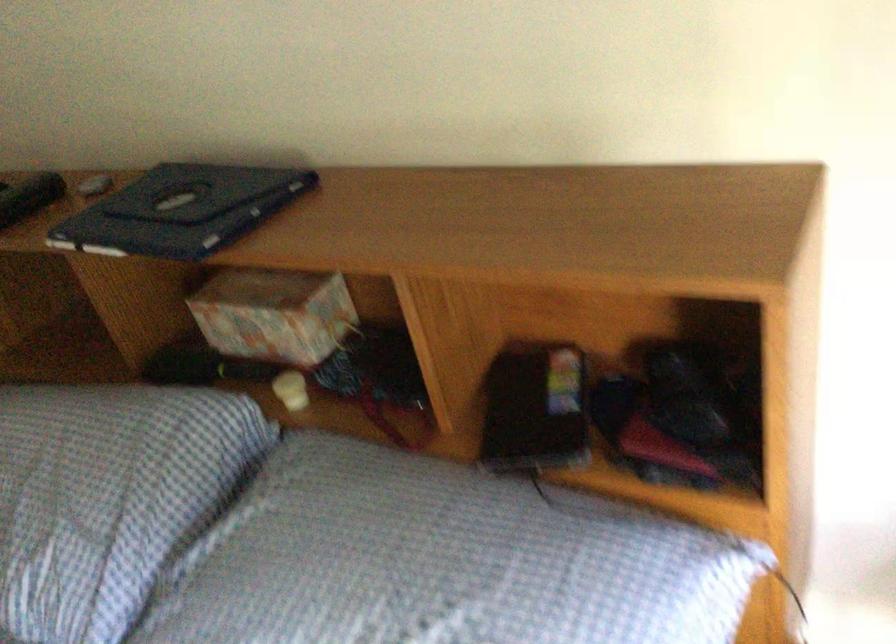
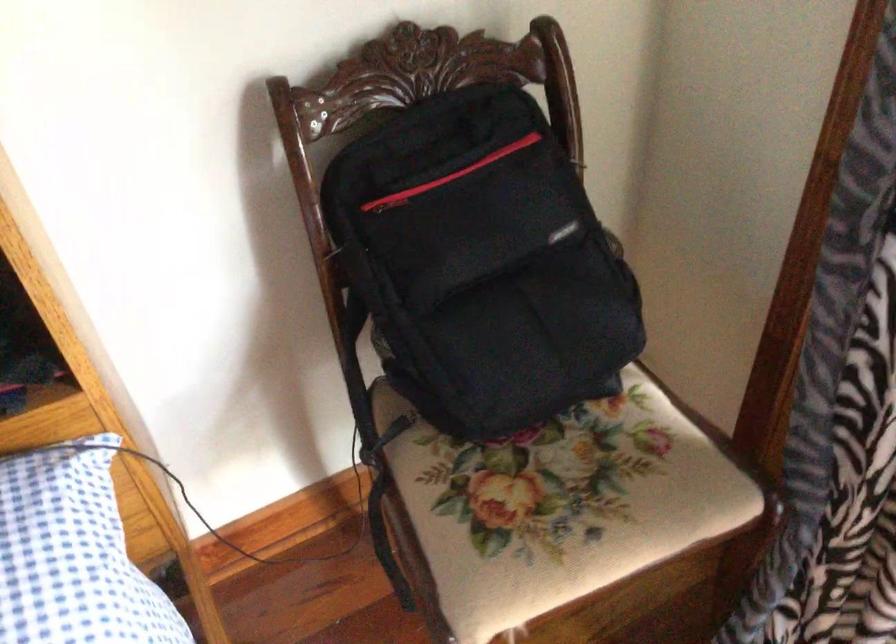
Question: How did the camera likely rotate?

Choices:
 (A) Left
 (B) Right
 (C) Up
 (D) Down

Answer: (B)